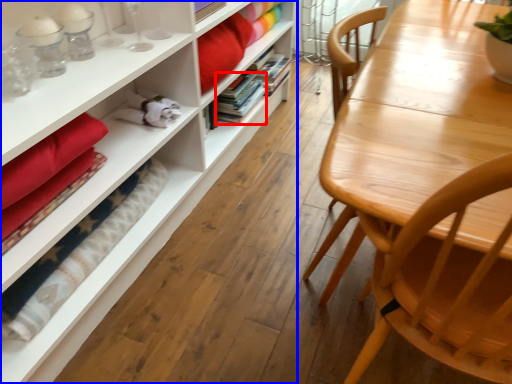
Question: Which of the following is the farthest to the observer, book (highlighted by a red box) or bookcase (highlighted by a blue box)?

Choices:
 (A) book
 (B) bookcase

Answer: (A)